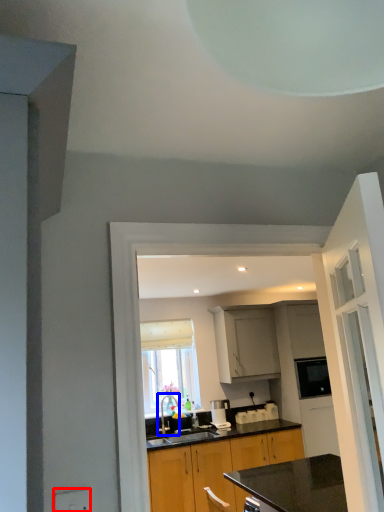
Question: Which object is further to the camera taking this photo, electric outlet (highlighted by a red box) or tap (highlighted by a blue box)?

Choices:
 (A) electric outlet
 (B) tap

Answer: (B)